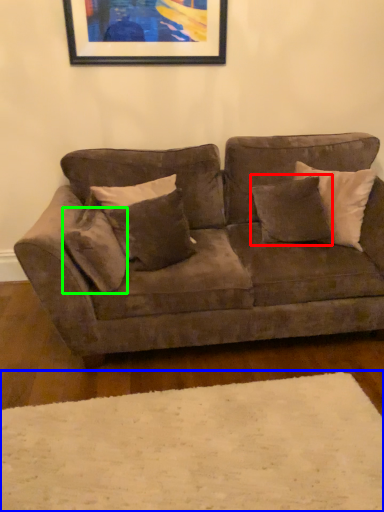
Question: Considering the real-world distances, which object is farthest from pillow (highlighted by a red box)? plain (highlighted by a blue box) or pillow (highlighted by a green box)?

Choices:
 (A) plain
 (B) pillow

Answer: (A)